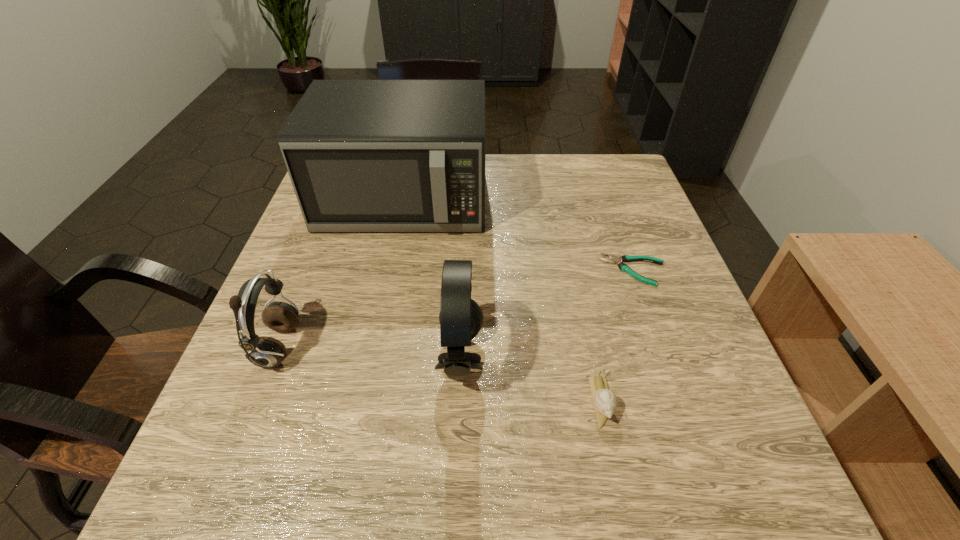
I want to click on microwave oven, so click(x=363, y=155).

The height and width of the screenshot is (540, 960). In order to click on the second tallest object in this screenshot , I will do `click(461, 318)`.

The height and width of the screenshot is (540, 960). Identify the location of the right earphone. (461, 318).

What are the coordinates of `the third shortest object` in the screenshot? It's located at (267, 352).

Find the location of a particular element. the left earphone is located at coordinates (267, 352).

Identify the location of escargot. tap(605, 402).

What are the coordinates of `the fourth object from left to right` in the screenshot? It's located at (605, 402).

Locate an element on the screen. This screenshot has width=960, height=540. the rightmost object is located at coordinates (626, 258).

You are a GUI agent. You are given a task and a screenshot of the screen. Output one action in this format:
    pyautogui.click(x=<x>, y=<y>)
    Task: Click on the pliers
    
    Given the screenshot: What is the action you would take?
    pyautogui.click(x=626, y=258)

Where is `vacant space situated on the front-facing side of the microwave oven`? vacant space situated on the front-facing side of the microwave oven is located at coordinates (376, 323).